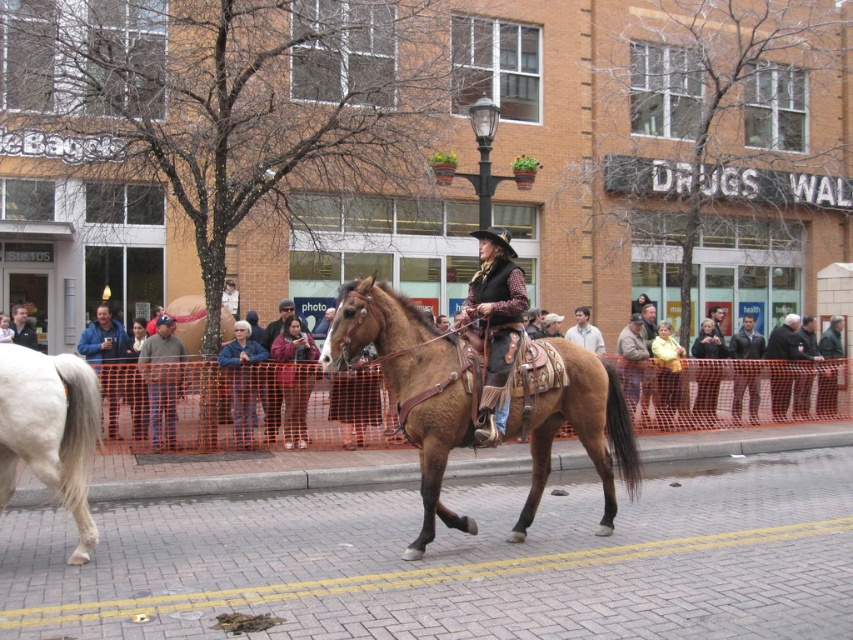
From the picture: You are standing at the origin point in the image. Which direction should you move to reach the white glossy horse at left?

The white glossy horse at left is located at coordinates 0.672 on the x axis and 0.059 on the y axis. Since you are at the origin, you should move towards the right and slightly downward to reach it.

You are a photographer standing at the position of the cowboy rider. You want to take a photo of both the point at coordinates point (401, 305) and point (10, 465) in the scene. Which point will appear closer to the camera in your photo?

Point (10, 465) will appear closer to the camera in the photo because it is physically closer to the photographer than point (401, 305), which is further away.

You are a photographer positioned at the center of the scene. You want to capture a clear photo of the leather vest at center without the white glossy horse at left blocking it. How should you adjust your position?

Since the white glossy horse at left is in front of the leather vest at center, you should move to the right to position yourself behind the horse so that the leather vest at center becomes visible without obstruction.